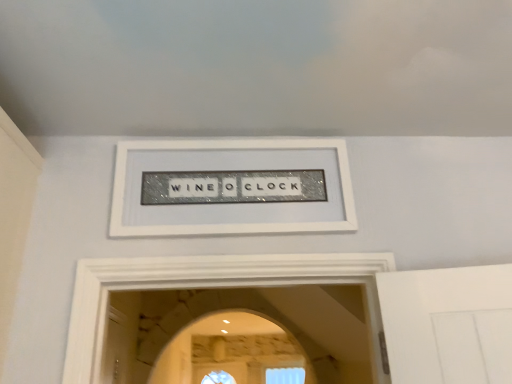
What is the approximate height of white textured frame at center?

33.19 centimeters.

The height and width of the screenshot is (384, 512). What do you see at coordinates (231, 204) in the screenshot? I see `white textured frame at center` at bounding box center [231, 204].

Measure the distance between white textured frame at center and camera.

They are 3.95 feet apart.

Identify the location of white textured frame at center. (231, 204).

At what (x,y) coordinates should I click in order to perform the action: click on white textured frame at center. Please return your answer as a coordinate pair (x, y). The image size is (512, 384). Looking at the image, I should click on (231, 204).